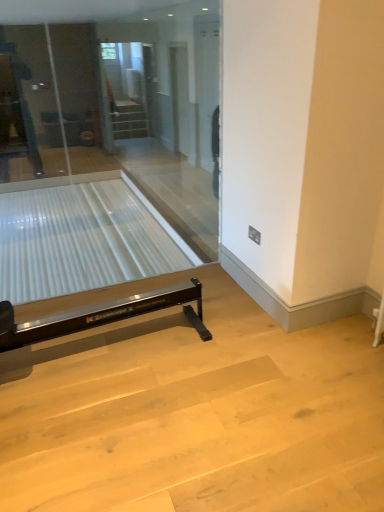
Question: Considering the positions of clear glass table at lower left and clear glass screen door at upper center in the image, is clear glass table at lower left bigger or smaller than clear glass screen door at upper center?

Choices:
 (A) small
 (B) big

Answer: (B)

Question: From the image's perspective, relative to clear glass screen door at upper center, is clear glass table at lower left above or below?

Choices:
 (A) above
 (B) below

Answer: (B)

Question: Which object is the closest to the transparent glass door at center?

Choices:
 (A) clear glass table at lower left
 (B) clear glass screen door at upper center

Answer: (A)

Question: Based on their relative distances, which object is nearer to the clear glass screen door at upper center?

Choices:
 (A) clear glass table at lower left
 (B) transparent glass door at center

Answer: (A)